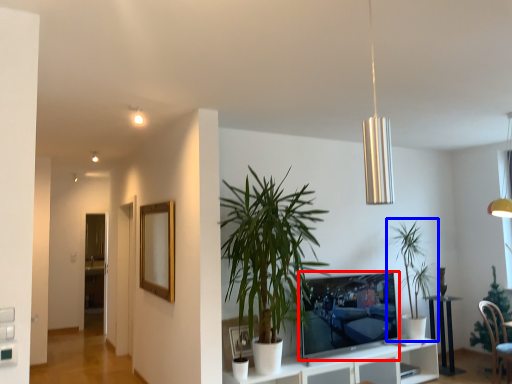
Question: Which point is closer to the camera, television (highlighted by a red box) or houseplant (highlighted by a blue box)?

Choices:
 (A) television
 (B) houseplant

Answer: (A)